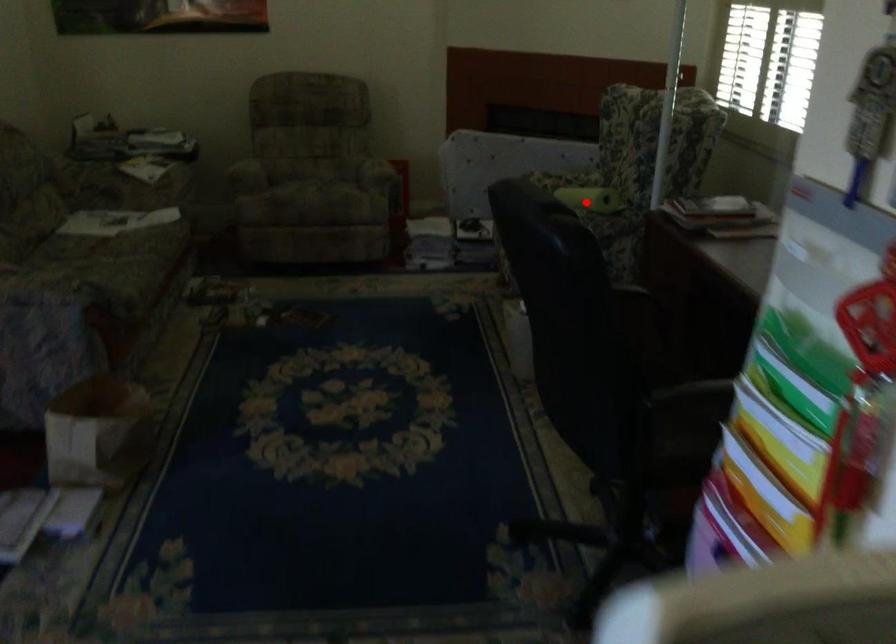
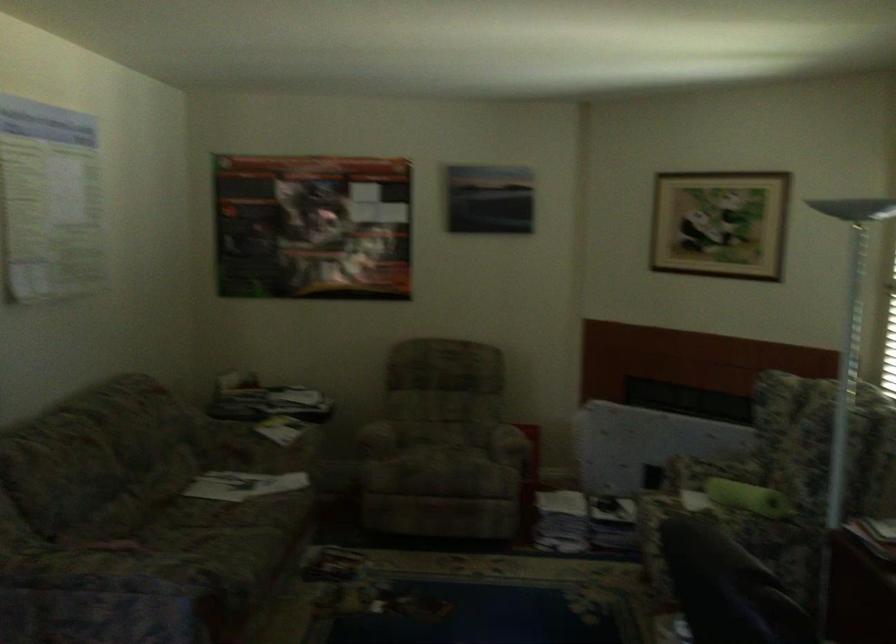
Question: I am providing you with two images of the same scene from different viewpoints. A red point is marked on the first image. Can you still see the location of the red point in image 2?

Choices:
 (A) Yes
 (B) No

Answer: (A)